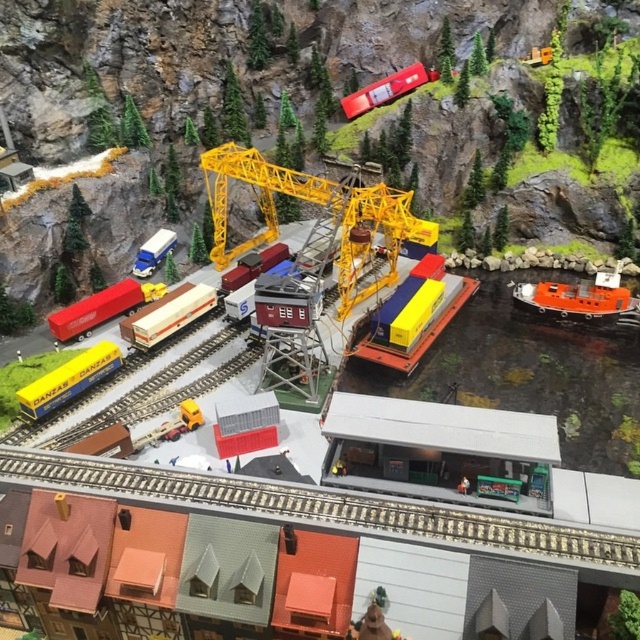
Does point (365, 296) come in front of point (188, 317)?

No.

From the picture: Who is lower down, yellow metallic crane at center or wooden grain train car at center?

wooden grain train car at center is lower down.

Between point (284, 180) and point (184, 308), which one is positioned behind?

Positioned behind is point (284, 180).

Where is `yellow metallic crane at center`? yellow metallic crane at center is located at coordinates (320, 205).

Is point (209, 294) behind point (401, 353)?

Yes, it is behind point (401, 353).

Between wooden grain train car at center and yellow matte container at center, which one appears on the right side from the viewer's perspective?

yellow matte container at center is more to the right.

At what (x,y) coordinates should I click in order to perform the action: click on wooden grain train car at center. Please return your answer as a coordinate pair (x, y). The height and width of the screenshot is (640, 640). Looking at the image, I should click on (168, 314).

Consider the image. Between orange matte boat at right and matte blue train car at lower left, which one appears on the right side from the viewer's perspective?

From the viewer's perspective, orange matte boat at right appears more on the right side.

Is point (628, 321) behind point (84, 353)?

Yes, it is behind point (84, 353).

You are a GUI agent. You are given a task and a screenshot of the screen. Output one action in this format:
    pyautogui.click(x=<x>, y=<y>)
    Task: Click on the orange matte boat at right
    The height and width of the screenshot is (640, 640).
    Given the screenshot: What is the action you would take?
    pyautogui.click(x=580, y=298)